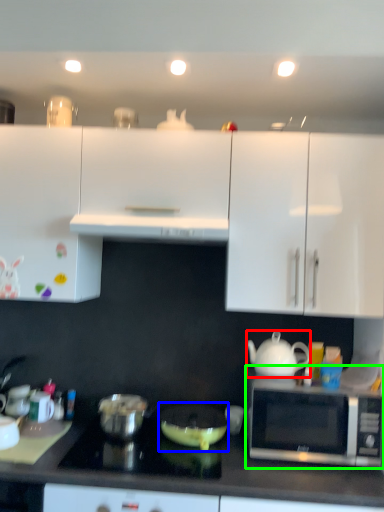
Question: Which object is positioned farthest from teapot (highlighted by a red box)? Select from appliance (highlighted by a blue box) and microwave oven (highlighted by a green box).

Choices:
 (A) appliance
 (B) microwave oven

Answer: (A)